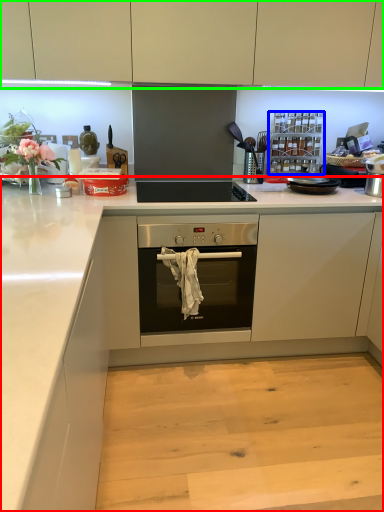
Question: Which is farther away from countertop (highlighted by a red box)? appliance (highlighted by a blue box) or cabinetry (highlighted by a green box)?

Choices:
 (A) appliance
 (B) cabinetry

Answer: (B)